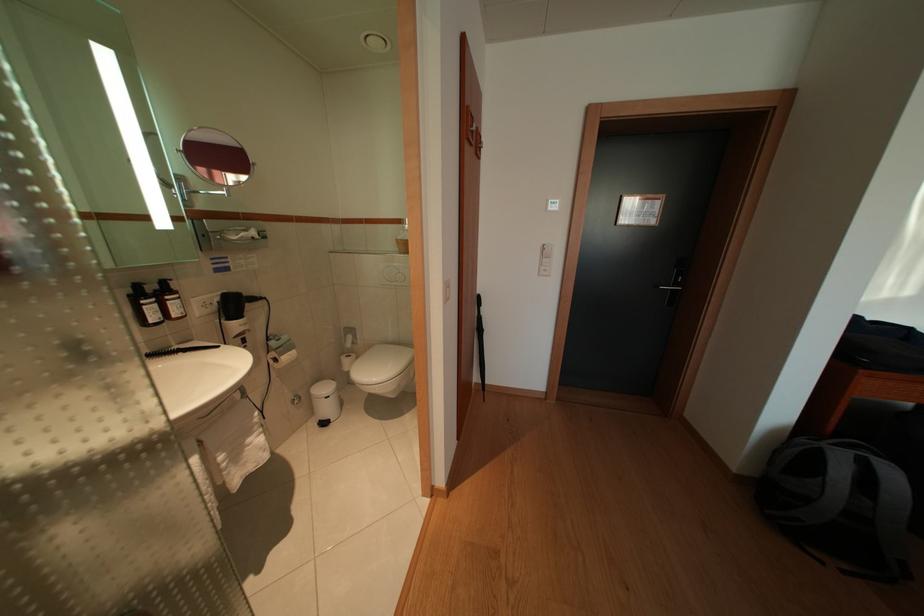
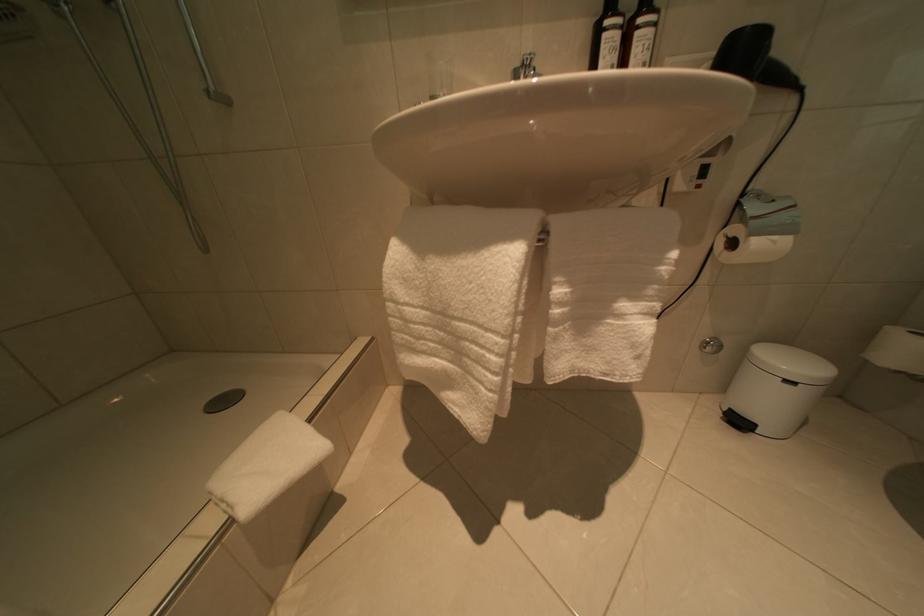
Where in the second image is the point corresponding to the point at 285,366 from the first image?

(740, 249)